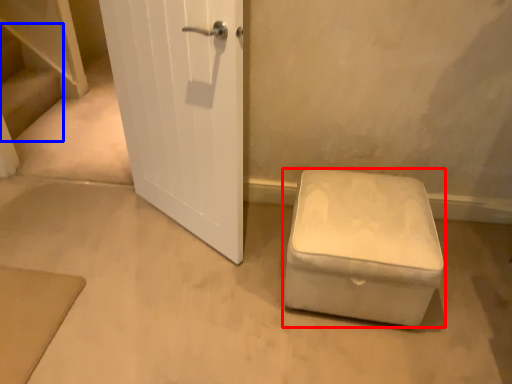
Question: Which of the following is the closest to the observer, furniture (highlighted by a red box) or stairwell (highlighted by a blue box)?

Choices:
 (A) furniture
 (B) stairwell

Answer: (A)